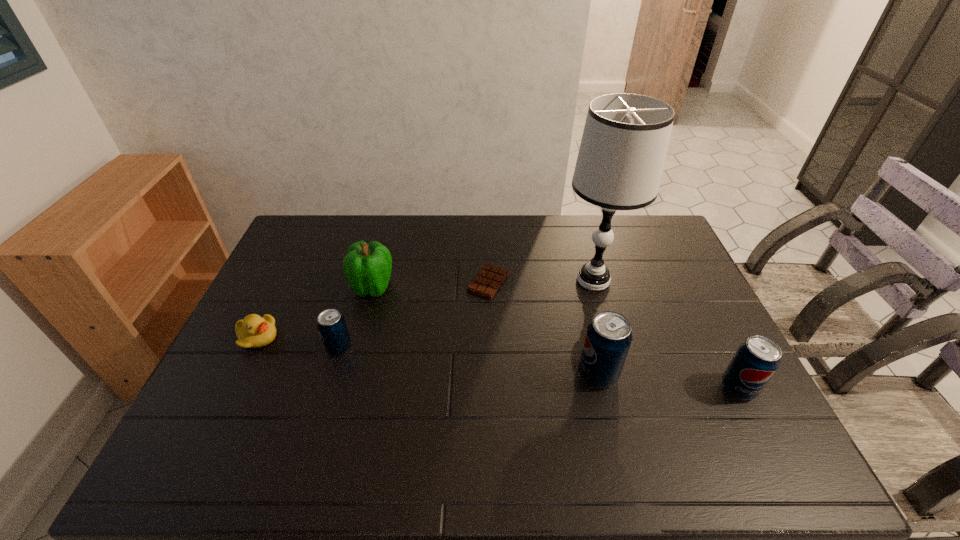
Where is `free spot that satisfies the following two spatial constraints: 1. on the front-facing side of the leftmost object; 2. on the back side of the rightmost object`? free spot that satisfies the following two spatial constraints: 1. on the front-facing side of the leftmost object; 2. on the back side of the rightmost object is located at coordinates (233, 388).

The height and width of the screenshot is (540, 960). Find the location of `vacant space that satisfies the following two spatial constraints: 1. on the front side of the second tallest soda can; 2. on the left side of the shortest soda can`. vacant space that satisfies the following two spatial constraints: 1. on the front side of the second tallest soda can; 2. on the left side of the shortest soda can is located at coordinates (327, 388).

The image size is (960, 540). Identify the location of vacant space that satisfies the following two spatial constraints: 1. on the front side of the third shortest object; 2. on the left side of the tallest soda can. (331, 374).

You are a GUI agent. You are given a task and a screenshot of the screen. Output one action in this format:
    pyautogui.click(x=<x>, y=<y>)
    Task: Click on the free spot that satisfies the following two spatial constraints: 1. on the front-facing side of the leftmost object; 2. on the left side of the rightmost soda can
    
    Given the screenshot: What is the action you would take?
    pyautogui.click(x=233, y=388)